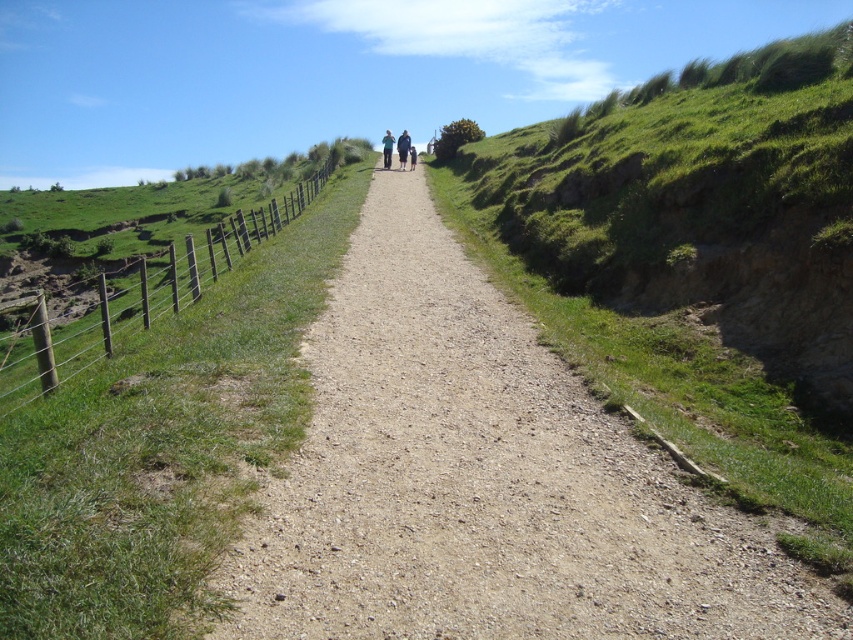
Which is above, dirt/gravel path at center or green wooden fence at left?

green wooden fence at left is higher up.

Does point (688, 596) come behind point (4, 360)?

No, (688, 596) is in front of (4, 360).

Who is more forward, (659,452) or (115,321)?

Point (659,452) is more forward.

At what (x,y) coordinates should I click in order to perform the action: click on dirt/gravel path at center. Please return your answer as a coordinate pair (x, y). The image size is (853, 640). Looking at the image, I should click on (483, 481).

Does dark blue jacket at center appear on the left side of light blue denim jacket at center?

Incorrect, dark blue jacket at center is not on the left side of light blue denim jacket at center.

Can you confirm if dark blue jacket at center is taller than light blue denim jacket at center?

No, dark blue jacket at center is not taller than light blue denim jacket at center.

In order to click on dark blue jacket at center in this screenshot , I will do `click(403, 147)`.

How distant is dirt/gravel path at center from green grassy hillside at right?

dirt/gravel path at center and green grassy hillside at right are 40.43 feet apart from each other.

Is point (442, 560) behind point (830, 268)?

No, it is in front of (830, 268).

Where is `dirt/gravel path at center`? This screenshot has width=853, height=640. dirt/gravel path at center is located at coordinates (483, 481).

Locate an element on the screen. The width and height of the screenshot is (853, 640). dirt/gravel path at center is located at coordinates (483, 481).